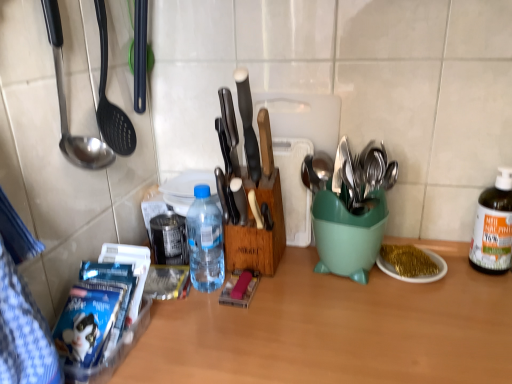
Question: In the image, is white plastic cutting board at center positioned in front of or behind stainless steel spoon at left, which is the 1th spoon in front-to-back order?

Choices:
 (A) front
 (B) behind

Answer: (B)

Question: From a real-world perspective, relative to stainless steel spoon at left, placed as the second spoon when sorted from back to front, is white plastic cutting board at center vertically above or below?

Choices:
 (A) below
 (B) above

Answer: (A)

Question: Considering the real-world distances, which object is farthest from the white plastic knife at center?

Choices:
 (A) gold glitter plate at right
 (B) stainless steel spoon at left, which is the 1th spoon in front-to-back order
 (C) green plastic spoon holder at right
 (D) white plastic cutting board at center
 (E) wooden table at center

Answer: (A)

Question: Which object is the farthest from the wooden spoon at center, marked as the 1th spoon in a back-to-front arrangement?

Choices:
 (A) gold glitter plate at right
 (B) wooden table at center
 (C) clear plastic bowl at center
 (D) green plastic bottle at right, the first bottle in the right-to-left sequence
 (E) stainless steel spoon at left, which is counted as the 2th spoon, starting from the right

Answer: (D)